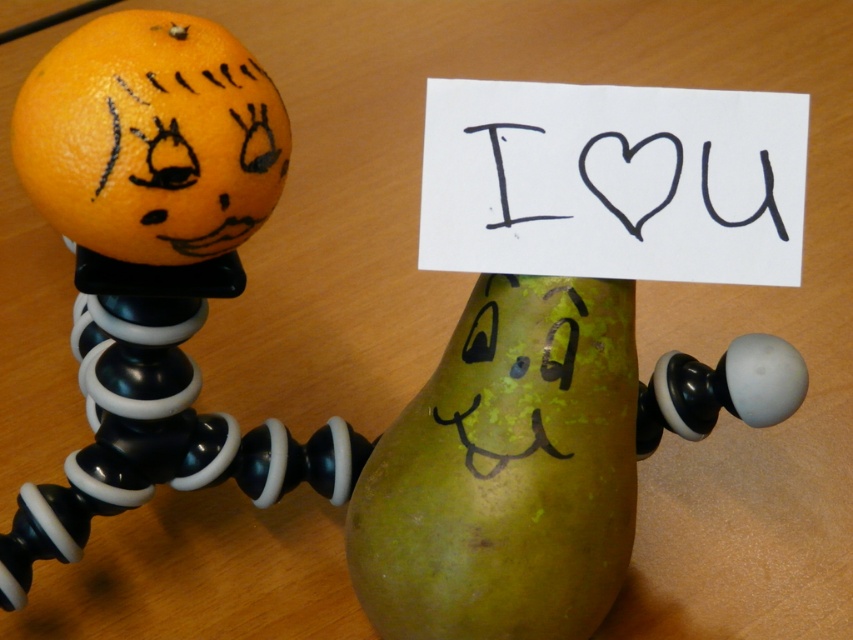
Question: Which point is farther to the camera?

Choices:
 (A) green matte pear at center
 (B) orangesmoothfruit at left
 (C) black paper at center

Answer: (C)

Question: Is green matte pear at center bigger than orangesmoothfruit at left?

Choices:
 (A) no
 (B) yes

Answer: (B)

Question: Is orangesmoothfruit at left smaller than black paper at center?

Choices:
 (A) yes
 (B) no

Answer: (B)

Question: Which point is farther to the camera?

Choices:
 (A) orangesmoothfruit at left
 (B) green matte pear at center

Answer: (B)

Question: Does orangesmoothfruit at left have a greater width compared to black paper at center?

Choices:
 (A) yes
 (B) no

Answer: (B)

Question: Which object is the farthest from the green matte pear at center?

Choices:
 (A) black paper at center
 (B) orangesmoothfruit at left

Answer: (B)